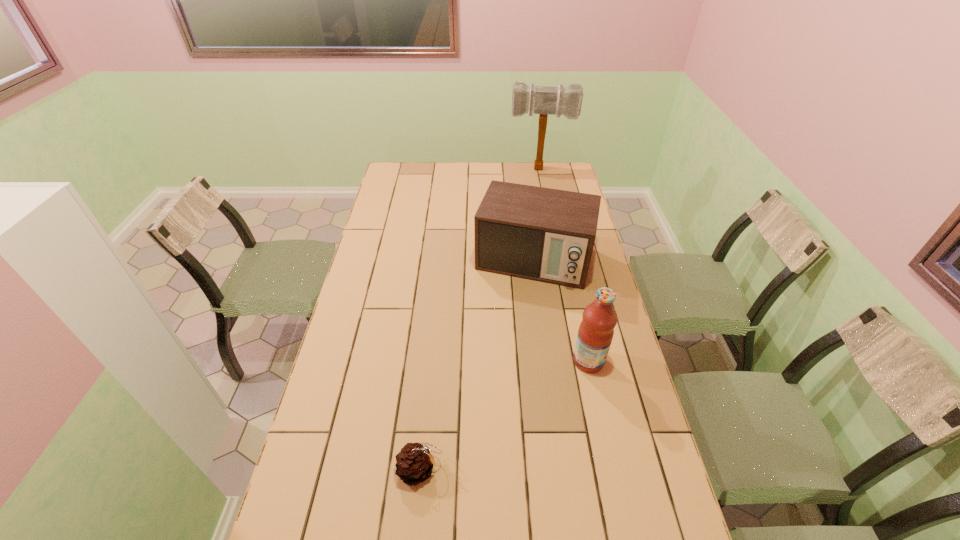
Select which object appears as the third closest to the tallest object. Please provide its 2D coordinates. Your answer should be formatted as a tuple, i.e. [(x, y)], where the tuple contains the x and y coordinates of a point satisfying the conditions above.

[(414, 463)]

Point out which object is positioned as the second nearest to the third farthest object. Please provide its 2D coordinates. Your answer should be formatted as a tuple, i.e. [(x, y)], where the tuple contains the x and y coordinates of a point satisfying the conditions above.

[(414, 463)]

The height and width of the screenshot is (540, 960). Identify the location of free space that satisfies the following two spatial constraints: 1. on the front side of the third nearest object; 2. on the front label of the fruit juice. (548, 361).

The width and height of the screenshot is (960, 540). What are the coordinates of `blank space that satisfies the following two spatial constraints: 1. on the front side of the radio receiver; 2. on the front label of the third shortest object` in the screenshot? It's located at (548, 361).